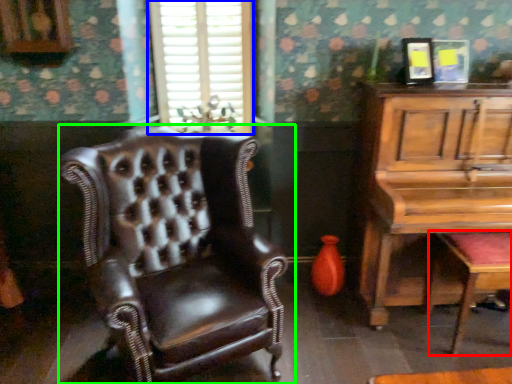
Question: Based on their relative distances, which object is farther from music stool (highlighted by a red box)? Choose from window (highlighted by a blue box) and chair (highlighted by a green box).

Choices:
 (A) window
 (B) chair

Answer: (A)